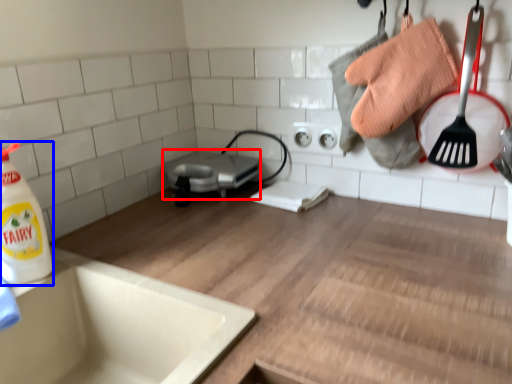
Question: Which of the following is the farthest to the observer, appliance (highlighted by a red box) or cleaning product (highlighted by a blue box)?

Choices:
 (A) appliance
 (B) cleaning product

Answer: (A)